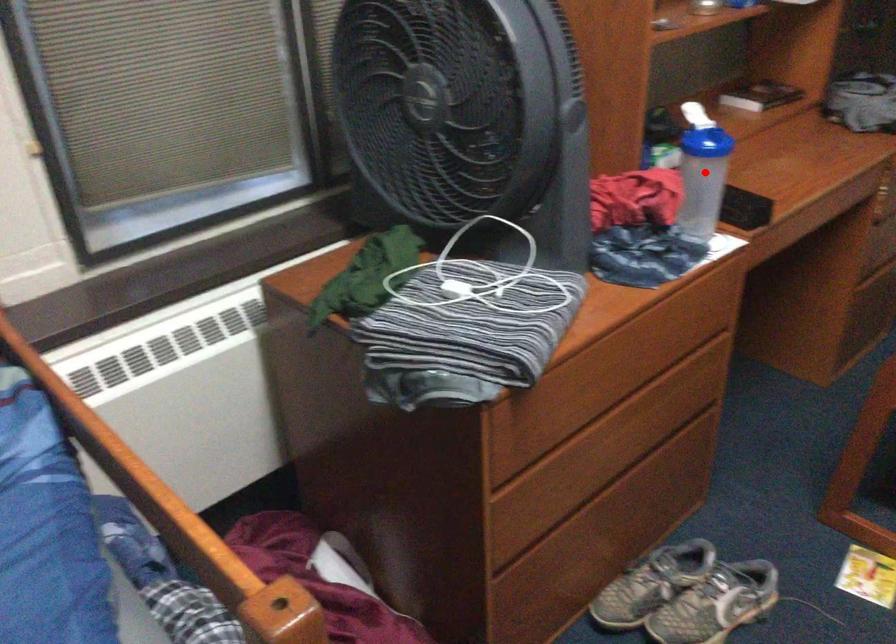
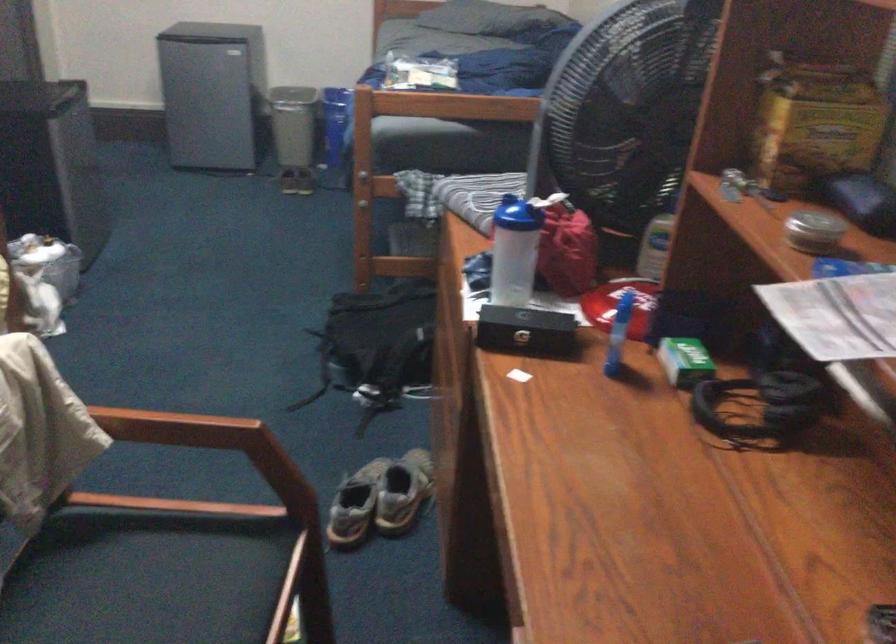
In the second image, find the point that corresponds to the highlighted location in the first image.

(513, 251)